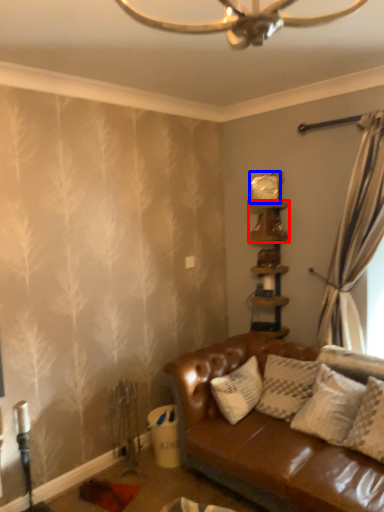
Question: Which object is further to the camera taking this photo, shelf (highlighted by a red box) or clock (highlighted by a blue box)?

Choices:
 (A) shelf
 (B) clock

Answer: (B)